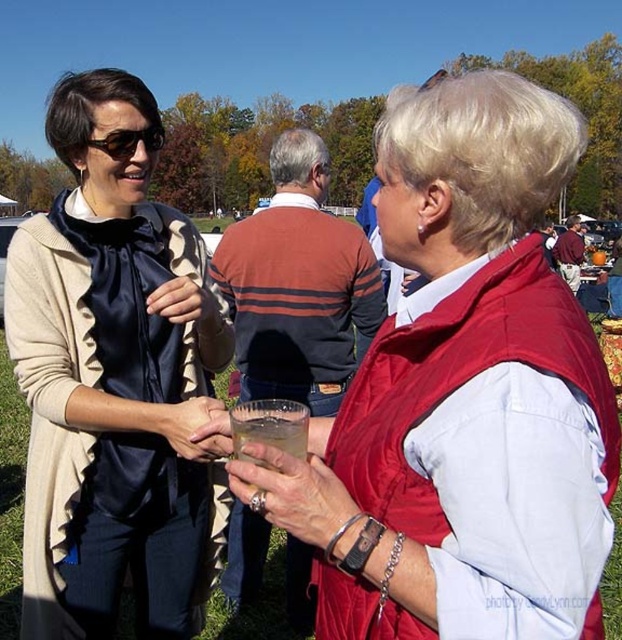
You are standing at point (x=123, y=141) and want to walk to point (x=460, y=291). According to the scene, which direction should you move to reach your destination?

To move from point (x=123, y=141) to point (x=460, y=291), you should move upward and to the right since point (x=460, y=291) is located above and to the right of point (x=123, y=141).

In the scene shown: You are a delivery robot with a width of 0.8 meters. You need to navigate through the space between the matte red vest at center and the matte black sunglasses at upper left. Can you fit through this space without touching either object?

The space between the matte red vest at center and the matte black sunglasses at upper left is 1.02 meters. Since your width is 0.8 meters, you can safely pass through the space as it is wider than your width.